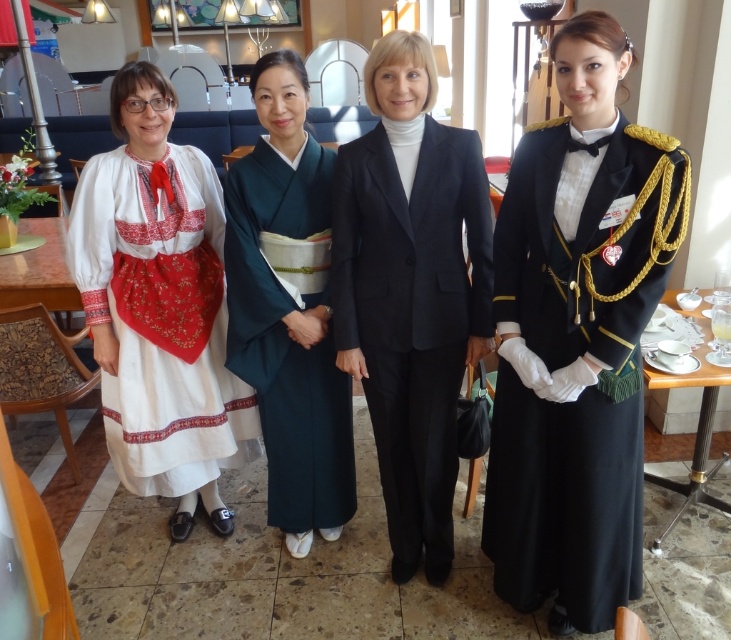
You are a photographer standing in front of the group. You want to take a photo that includes both the white embroidered dress at left and the teal silk kimono at center. Which of the two outfits is closer to you?

The white embroidered dress at left is closer to you because it is positioned further to the viewer than the teal silk kimono at center.

You are a photographer positioned in front of the group. You want to take a photo focusing on the shiny black uniform at right and the white embroidered dress at left. Which of the two is closer to you?

The shiny black uniform at right is closer to the viewer than the white embroidered dress at left.